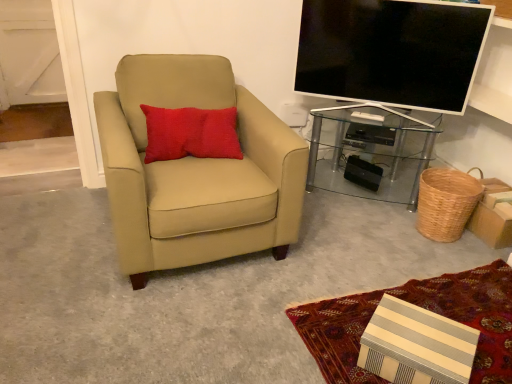
Question: Considering the relative sizes of matte black tv at upper right and transparent glass desk at right in the image provided, is matte black tv at upper right wider than transparent glass desk at right?

Choices:
 (A) yes
 (B) no

Answer: (B)

Question: Considering the relative sizes of matte black tv at upper right and transparent glass desk at right in the image provided, is matte black tv at upper right bigger than transparent glass desk at right?

Choices:
 (A) yes
 (B) no

Answer: (B)

Question: Is matte black tv at upper right at the left side of transparent glass desk at right?

Choices:
 (A) no
 (B) yes

Answer: (B)

Question: From the image's perspective, would you say matte black tv at upper right is shown under transparent glass desk at right?

Choices:
 (A) no
 (B) yes

Answer: (A)

Question: Considering the relative sizes of matte black tv at upper right and transparent glass desk at right in the image provided, is matte black tv at upper right shorter than transparent glass desk at right?

Choices:
 (A) yes
 (B) no

Answer: (B)

Question: Does matte black tv at upper right contain transparent glass desk at right?

Choices:
 (A) no
 (B) yes

Answer: (A)

Question: From the image's perspective, is woven brown basket at lower right above matte black tv at upper right?

Choices:
 (A) no
 (B) yes

Answer: (A)

Question: Can you confirm if woven brown basket at lower right is bigger than matte black tv at upper right?

Choices:
 (A) no
 (B) yes

Answer: (A)

Question: Is woven brown basket at lower right oriented away from matte black tv at upper right?

Choices:
 (A) yes
 (B) no

Answer: (B)

Question: From a real-world perspective, does woven brown basket at lower right stand above matte black tv at upper right?

Choices:
 (A) no
 (B) yes

Answer: (A)

Question: Is woven brown basket at lower right located outside matte black tv at upper right?

Choices:
 (A) no
 (B) yes

Answer: (B)

Question: Does woven brown basket at lower right appear on the right side of matte black tv at upper right?

Choices:
 (A) no
 (B) yes

Answer: (B)

Question: From the image's perspective, does woven brown basket at lower right appear lower than red textured pillow at upper left?

Choices:
 (A) no
 (B) yes

Answer: (B)